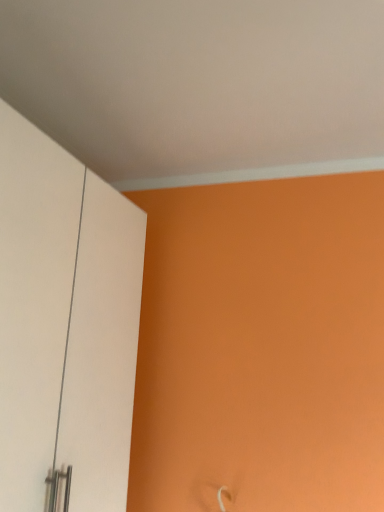
What is the approximate width of white glossy cupboard at left?

26.09 inches.

The height and width of the screenshot is (512, 384). Describe the element at coordinates (65, 324) in the screenshot. I see `white glossy cupboard at left` at that location.

Identify the location of white glossy cupboard at left. The height and width of the screenshot is (512, 384). (65, 324).

At what (x,y) coordinates should I click in order to perform the action: click on white glossy cupboard at left. Please return your answer as a coordinate pair (x, y). The height and width of the screenshot is (512, 384). Looking at the image, I should click on (65, 324).